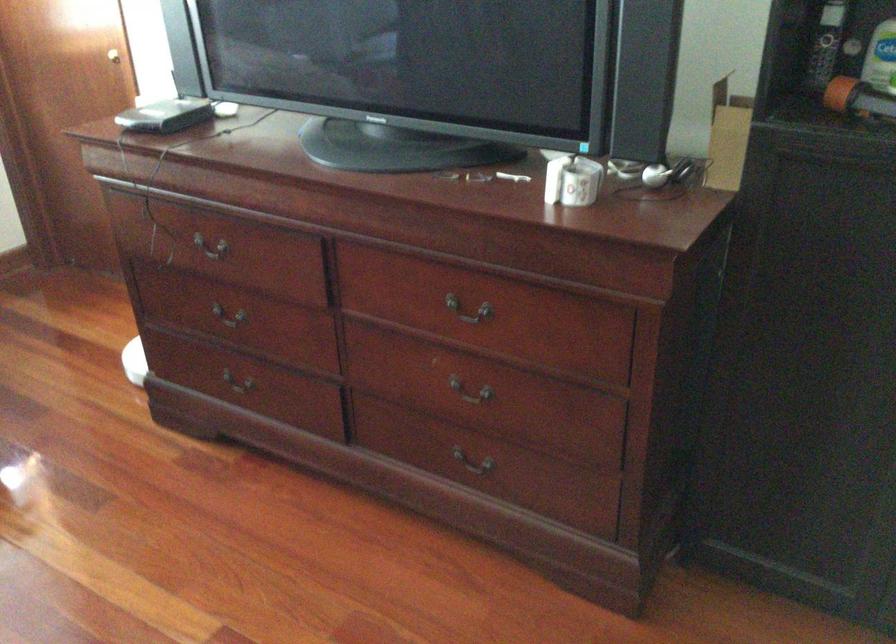
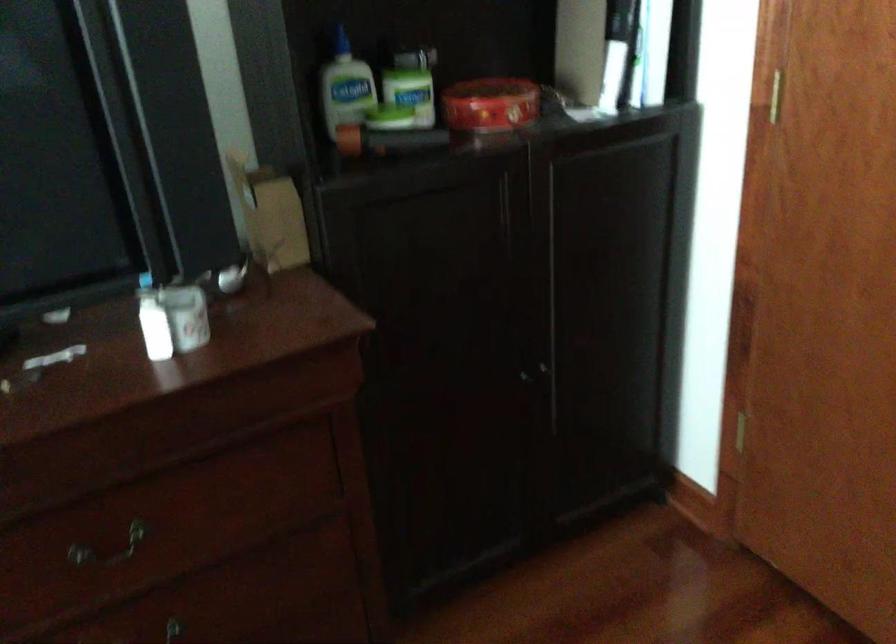
Question: Based on the continuous images, in which direction is the camera rotating? Reply with the corresponding letter.

Choices:
 (A) Left
 (B) Right
 (C) Up
 (D) Down

Answer: (B)